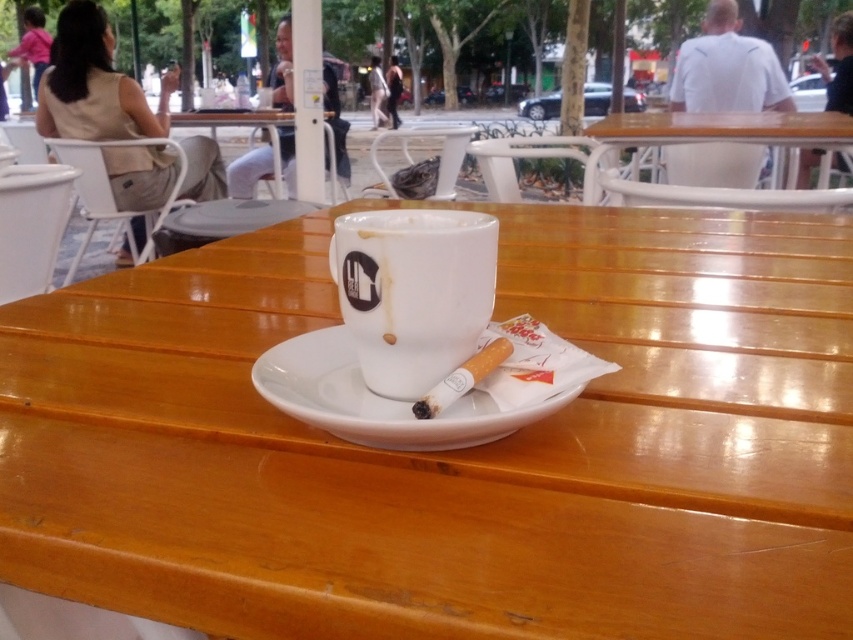
Who is higher up, wooden table at center or white glossy mug at center?

Positioned higher is wooden table at center.

The width and height of the screenshot is (853, 640). What do you see at coordinates (454, 451) in the screenshot?
I see `wooden table at center` at bounding box center [454, 451].

In order to click on wooden table at center in this screenshot , I will do `click(454, 451)`.

Can you confirm if white ceramic saucer at center is positioned to the left of wooden table at upper right?

Indeed, white ceramic saucer at center is positioned on the left side of wooden table at upper right.

Who is shorter, white ceramic saucer at center or wooden table at upper right?

white ceramic saucer at center is shorter.

Does point (312, 346) come farther from viewer compared to point (590, 196)?

No, it is not.

Where is `white ceramic saucer at center`? white ceramic saucer at center is located at coordinates pyautogui.click(x=376, y=400).

Between wooden table at center and white ceramic saucer at center, which one is positioned lower?

Positioned lower is white ceramic saucer at center.

Does wooden table at center have a smaller size compared to white ceramic saucer at center?

No, wooden table at center is not smaller than white ceramic saucer at center.

Image resolution: width=853 pixels, height=640 pixels. I want to click on wooden table at center, so click(x=454, y=451).

Find the location of a particular element. wooden table at center is located at coordinates pyautogui.click(x=454, y=451).